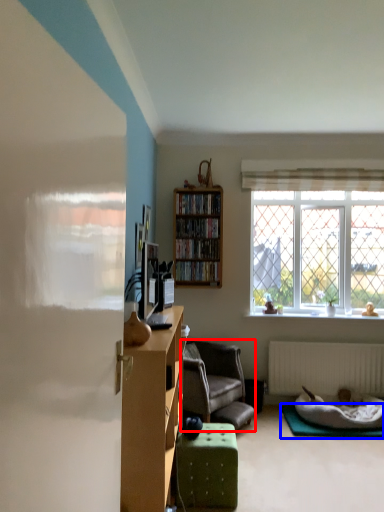
Question: Which object is further to the camera taking this photo, chair (highlighted by a red box) or yoga mat (highlighted by a blue box)?

Choices:
 (A) chair
 (B) yoga mat

Answer: (B)